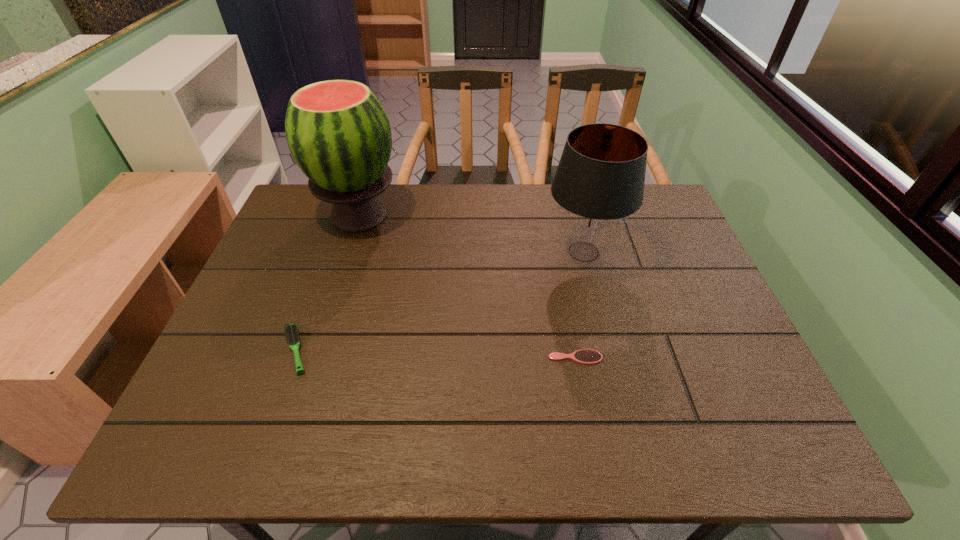
This screenshot has width=960, height=540. Identify the location of watermelon. 338,132.

The image size is (960, 540). I want to click on lampshade, so click(599, 182).

Locate an element on the screen. the taller hairbrush is located at coordinates (291, 330).

Where is `the second shortest object`? the second shortest object is located at coordinates (291, 330).

Identify the location of the shortest object. (585, 356).

What are the coordinates of `the right hairbrush` in the screenshot? It's located at (585, 356).

Identify the location of vacant area situated on the right of the watermelon. The width and height of the screenshot is (960, 540). (432, 215).

Locate an element on the screen. This screenshot has height=540, width=960. free space located 0.180m on the back of the lampshade is located at coordinates (569, 192).

You are a GUI agent. You are given a task and a screenshot of the screen. Output one action in this format:
    pyautogui.click(x=<x>, y=<y>)
    Task: Click on the vacant space located on the right of the third tallest object
    
    Given the screenshot: What is the action you would take?
    pyautogui.click(x=467, y=350)

Where is `free space located 0.250m on the right of the right hairbrush`? Image resolution: width=960 pixels, height=540 pixels. free space located 0.250m on the right of the right hairbrush is located at coordinates click(x=713, y=357).